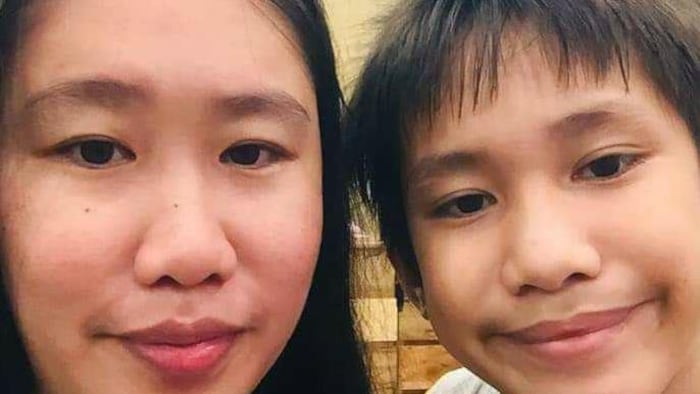
Locate an element on the screen. The width and height of the screenshot is (700, 394). wall is located at coordinates (410, 355).